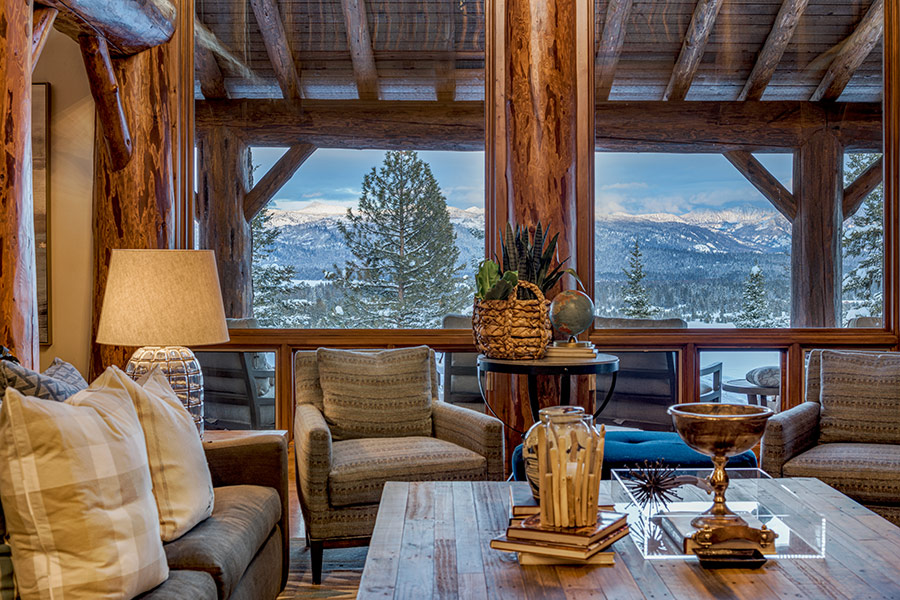
The height and width of the screenshot is (600, 900). I want to click on dark brown wood cross beam, so click(348, 114), click(715, 121).